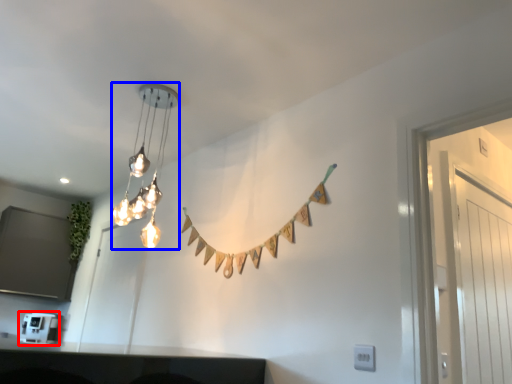
Question: Which of the following is the closest to the observer, appliance (highlighted by a red box) or lamp (highlighted by a blue box)?

Choices:
 (A) appliance
 (B) lamp

Answer: (B)